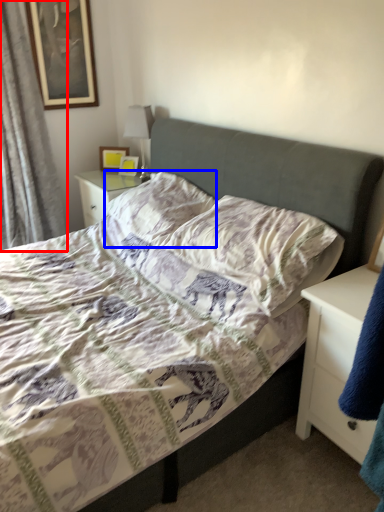
Question: Which object is closer to the camera taking this photo, curtain (highlighted by a red box) or pillow (highlighted by a blue box)?

Choices:
 (A) curtain
 (B) pillow

Answer: (B)